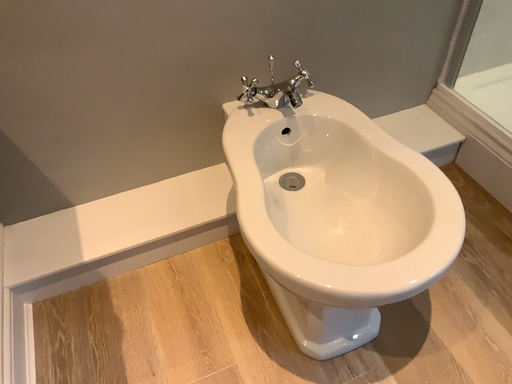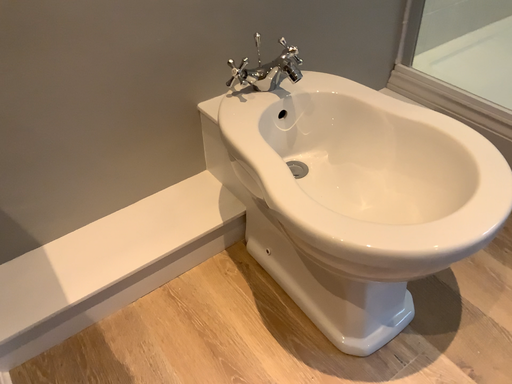
Question: How did the camera likely rotate when shooting the video?

Choices:
 (A) rotated right
 (B) rotated left

Answer: (A)